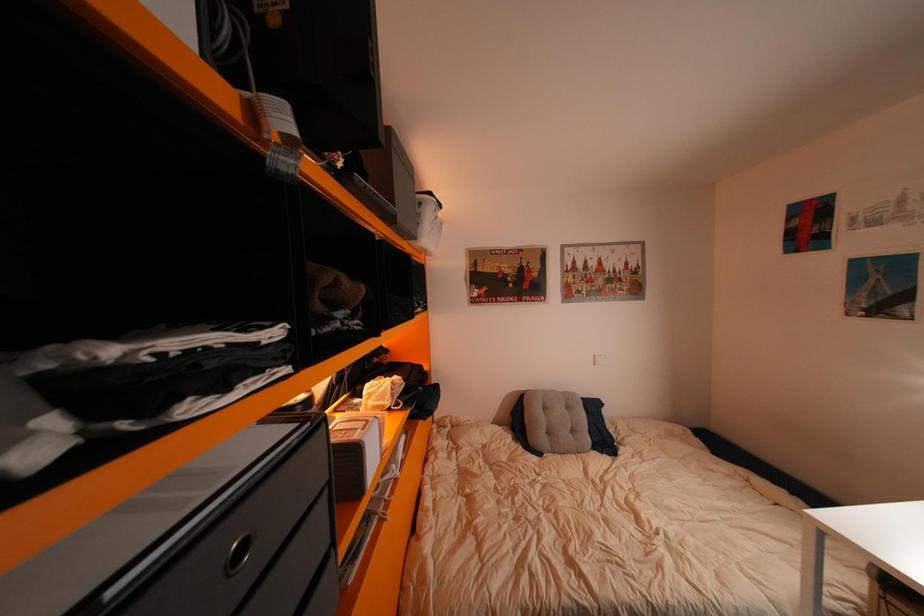
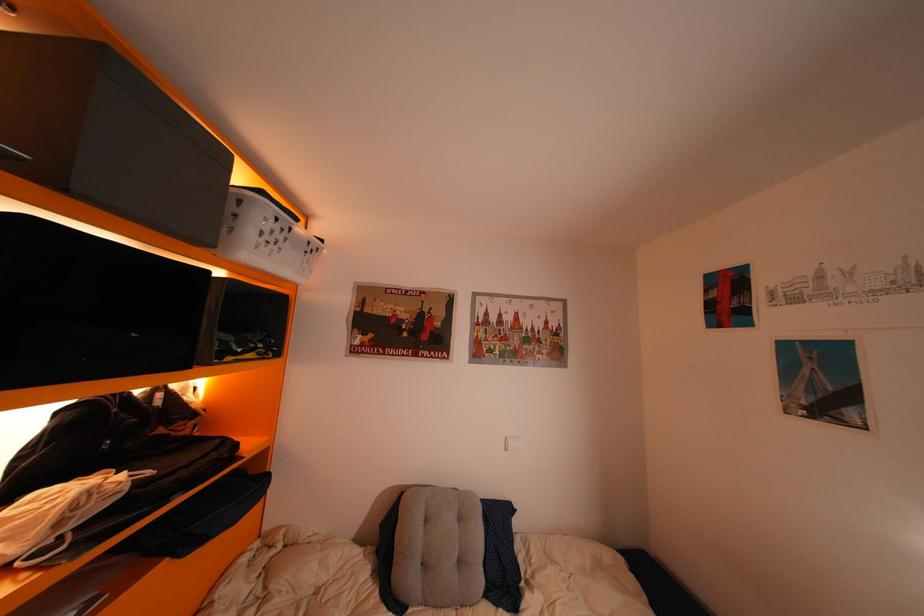
What movement of the cameraman would produce the second image?

The cameraman walked toward right, forward.